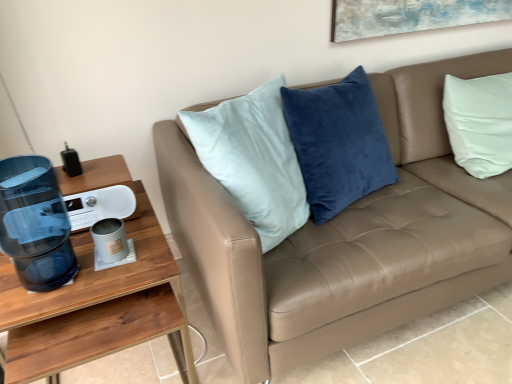
Where is `empty space that is ontop of wooden desk at left (from a real-world perspective)`? empty space that is ontop of wooden desk at left (from a real-world perspective) is located at coordinates pyautogui.click(x=78, y=271).